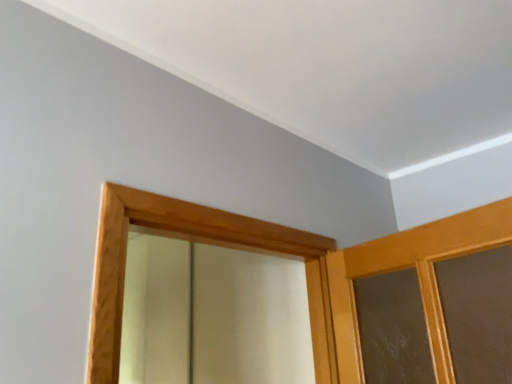
Describe the element at coordinates (212, 315) in the screenshot. I see `matte wooden mirror at center` at that location.

Identify the location of matte wooden mirror at center. The image size is (512, 384). (212, 315).

What is the approximate height of matte wooden mirror at center?

matte wooden mirror at center is 3.37 feet in height.

Where is `matte wooden mirror at center`? matte wooden mirror at center is located at coordinates (212, 315).